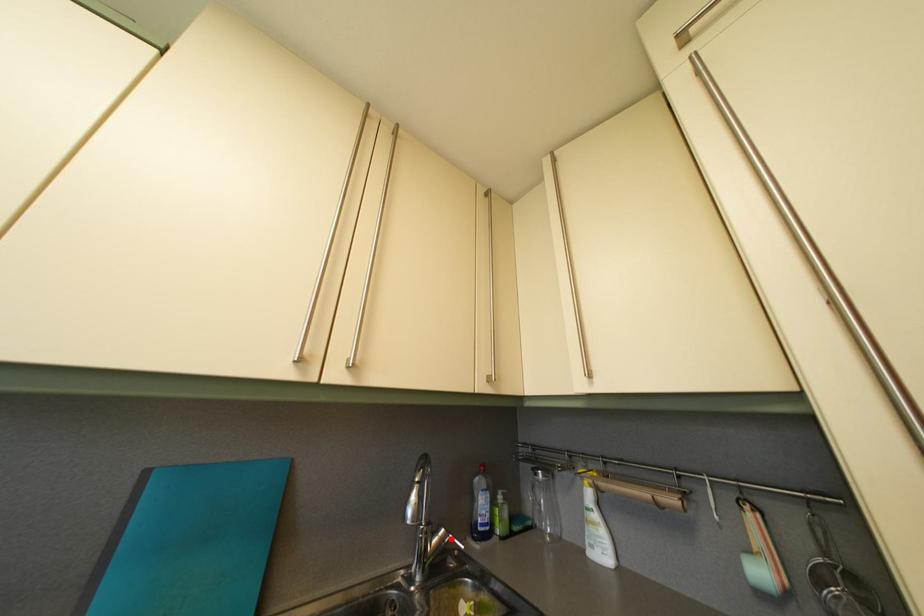
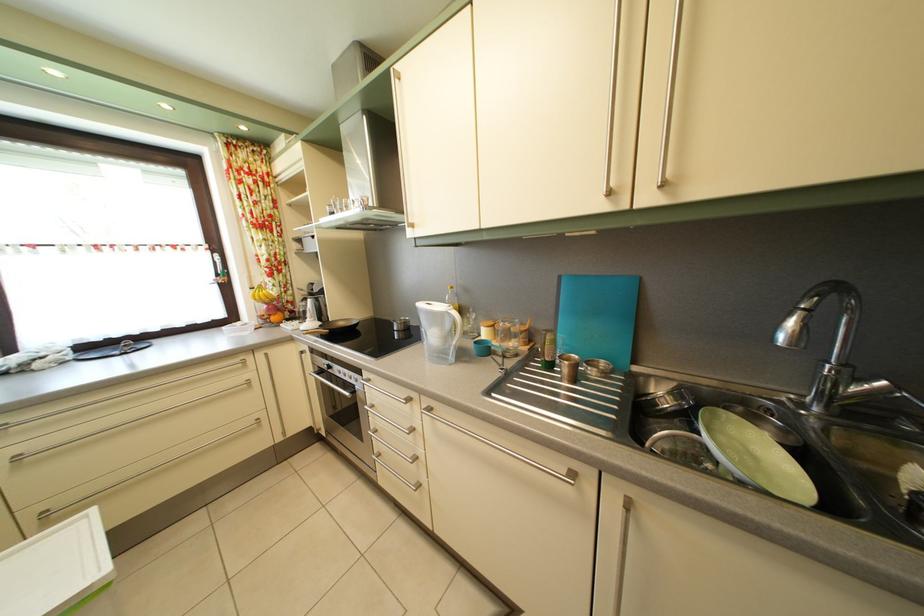
In the second image, find the point that corresponds to the highlighted location in the first image.

(893, 391)